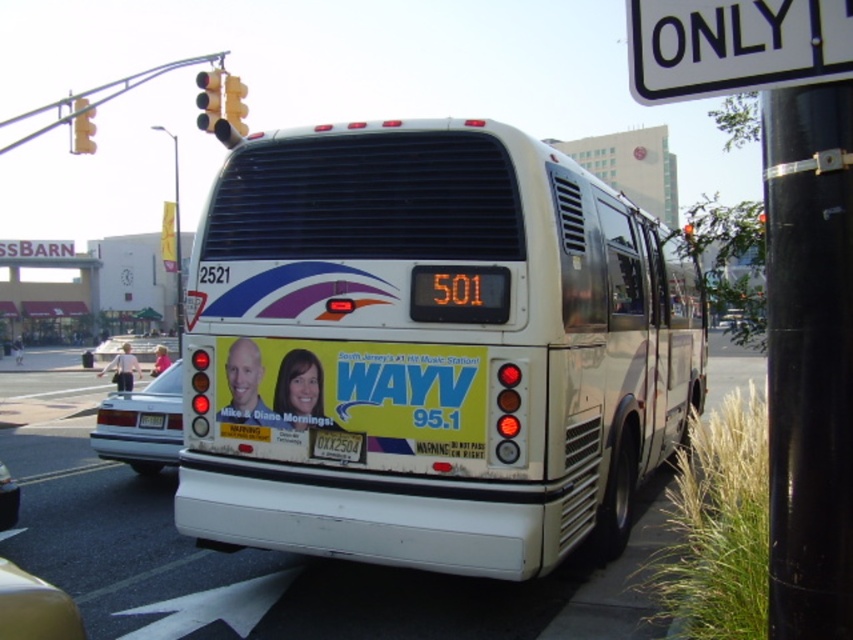
You are a driver approaching the intersection and see the yellow matte traffic light at upper left and the yellow plastic traffic light at upper center. Which traffic light is taller?

The yellow matte traffic light at upper left is taller than the yellow plastic traffic light at upper center.

You are a driver approaching the intersection and need to determine which object is bigger between the white plastic sign at upper right and the yellow glass traffic light at upper center. Which one is larger?

The white plastic sign at upper right has a larger size compared to the yellow glass traffic light at upper center, so the white plastic sign at upper right is bigger.

You are a delivery driver who needs to know which object is wider between the white plastic sign at upper right and the yellow glass traffic light at upper center. Which one is wider?

The white plastic sign at upper right is wider than the yellow glass traffic light at upper center because the white plastic sign at upper right surpasses the yellow glass traffic light at upper center in width.